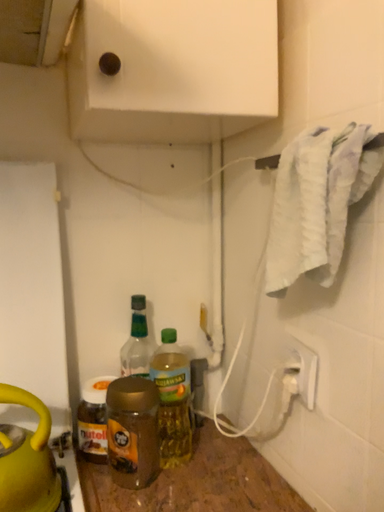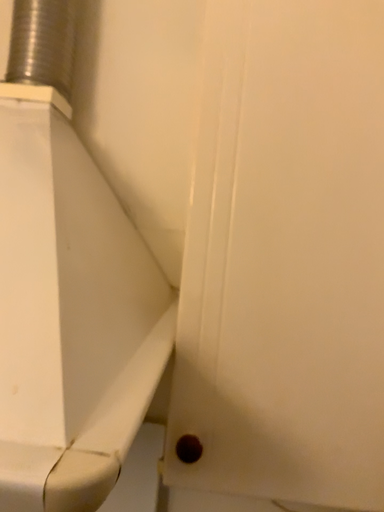
Question: Which way did the camera rotate in the video?

Choices:
 (A) rotated left
 (B) rotated right

Answer: (A)